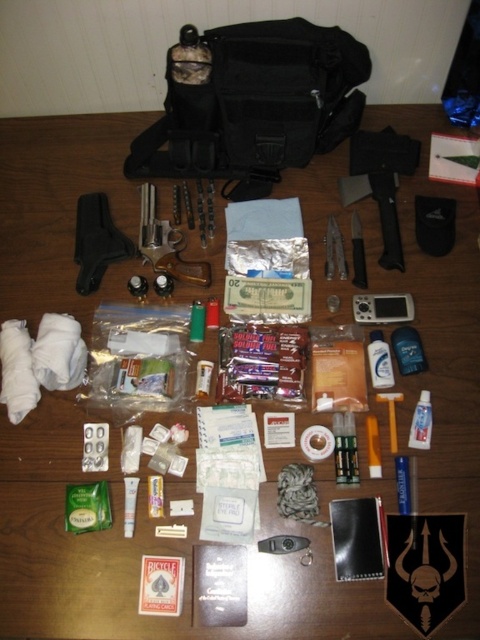
You are packing a survival kit and need to place the matte black hatchet at center and the white plastic razor at center into a compartment that is 17 inches wide. Will both items fit side by side in the compartment?

The matte black hatchet at center and white plastic razor at center are 16.96 inches apart from each other, so they can fit side by side in the 17 inch compartment since the distance between them is slightly less than the compartment width.

You are looking at the wooden table with the survival kit items. There are two points marked on the table surface at coordinates point (427, 410) and point (343, 259). Which of these points is closer to you?

Point (427, 410) is closer to the camera than point (343, 259), so the point closer to you is point (427, 410).

You are standing in front of the wooden table with the survival kit items. There are two points marked on the table surface. One is at coordinate point (x=387, y=179) and the other is at point (x=423, y=444). Which point is closer to you?

Point (x=387, y=179) is closer to you because it is further to the viewer than point (x=423, y=444).